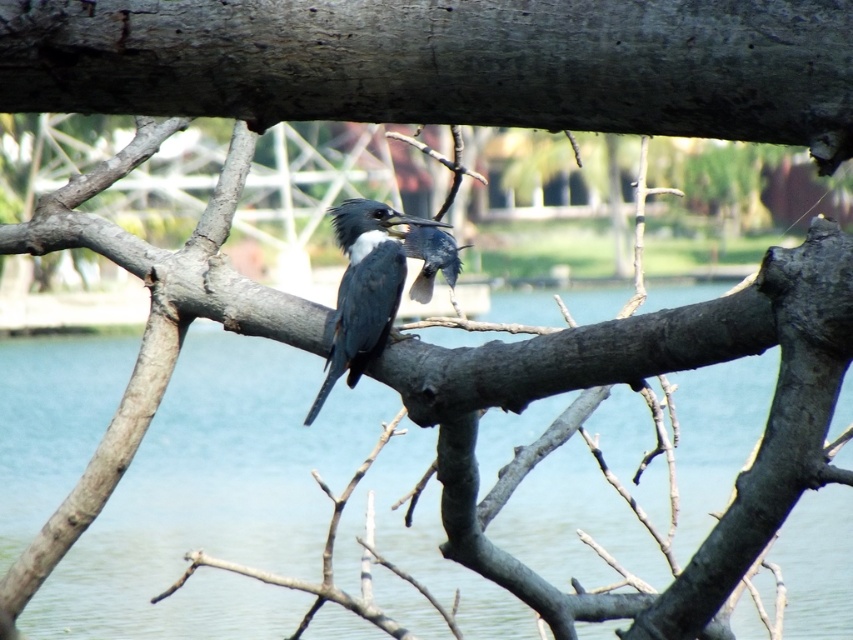
From the picture: Can you confirm if shiny blue bird at center is bigger than blue-gray feathers at center?

Yes.

Is shiny blue bird at center shorter than blue-gray feathers at center?

Incorrect, shiny blue bird at center's height does not fall short of blue-gray feathers at center's.

Which is behind, point (357, 221) or point (445, 240)?

Positioned behind is point (445, 240).

The height and width of the screenshot is (640, 853). I want to click on shiny blue bird at center, so click(x=364, y=289).

What do you see at coordinates (215, 499) in the screenshot? The width and height of the screenshot is (853, 640). I see `transparent water at branch center` at bounding box center [215, 499].

Is point (265, 426) more distant than point (354, 332)?

Yes, point (265, 426) is farther from viewer.

Which is behind, point (680, 424) or point (393, 237)?

The point (680, 424) is behind.

Where is `transparent water at branch center`? transparent water at branch center is located at coordinates (215, 499).

Does transparent water at branch center come behind blue-gray feathers at center?

No, it is in front of blue-gray feathers at center.

Between transparent water at branch center and blue-gray feathers at center, which one appears on the left side from the viewer's perspective?

From the viewer's perspective, blue-gray feathers at center appears more on the left side.

Locate an element on the screen. This screenshot has height=640, width=853. transparent water at branch center is located at coordinates (215, 499).

I want to click on transparent water at branch center, so click(x=215, y=499).